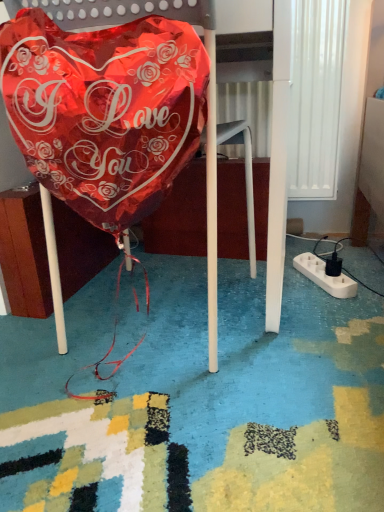
Question: Is shiny metallic balloon at center shorter than white plastic extension cord at lower right?

Choices:
 (A) no
 (B) yes

Answer: (A)

Question: Is shiny metallic balloon at center to the right of white plastic extension cord at lower right from the viewer's perspective?

Choices:
 (A) yes
 (B) no

Answer: (B)

Question: Can you confirm if shiny metallic balloon at center is smaller than white plastic extension cord at lower right?

Choices:
 (A) no
 (B) yes

Answer: (A)

Question: Can you confirm if shiny metallic balloon at center is thinner than white plastic extension cord at lower right?

Choices:
 (A) no
 (B) yes

Answer: (A)

Question: Is shiny metallic balloon at center behind white plastic extension cord at lower right?

Choices:
 (A) no
 (B) yes

Answer: (A)

Question: Could you tell me if shiny metallic balloon at center is turned towards white plastic extension cord at lower right?

Choices:
 (A) yes
 (B) no

Answer: (B)

Question: Is shiny metallic balloon at left turned away from shiny metallic balloon at center?

Choices:
 (A) yes
 (B) no

Answer: (A)

Question: Is shiny metallic balloon at left bigger than shiny metallic balloon at center?

Choices:
 (A) no
 (B) yes

Answer: (A)

Question: Is shiny metallic balloon at left placed right next to shiny metallic balloon at center?

Choices:
 (A) yes
 (B) no

Answer: (B)

Question: Are shiny metallic balloon at left and shiny metallic balloon at center far apart?

Choices:
 (A) no
 (B) yes

Answer: (A)

Question: From a real-world perspective, is shiny metallic balloon at left below shiny metallic balloon at center?

Choices:
 (A) no
 (B) yes

Answer: (B)

Question: Can you confirm if shiny metallic balloon at left is shorter than shiny metallic balloon at center?

Choices:
 (A) yes
 (B) no

Answer: (A)

Question: Is there a large distance between shiny metallic balloon at center and shiny metallic balloon at left?

Choices:
 (A) no
 (B) yes

Answer: (A)